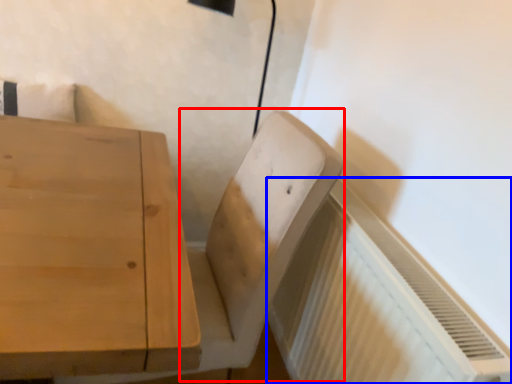
Question: Which object appears closest to the camera in this image, swivel chair (highlighted by a red box) or radiator (highlighted by a blue box)?

Choices:
 (A) swivel chair
 (B) radiator

Answer: (B)